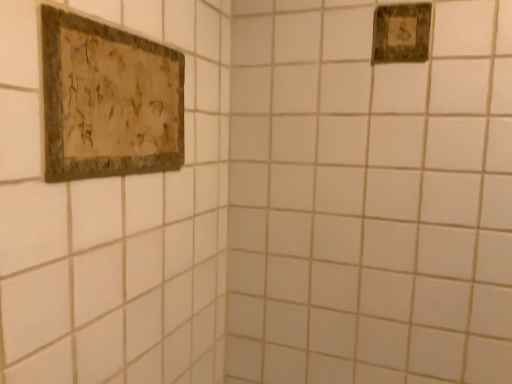
Question: In the image, is rustic wood sign at upper right, positioned as the 1th picture frame in top-to-bottom order, positioned in front of or behind rustic wood picture frame at upper left, acting as the second picture frame starting from the right?

Choices:
 (A) behind
 (B) front

Answer: (A)

Question: From the image's perspective, is rustic wood sign at upper right, placed as the 2th picture frame when sorted from left to right, positioned above or below rustic wood picture frame at upper left, the 2th picture frame in the back-to-front sequence?

Choices:
 (A) above
 (B) below

Answer: (A)

Question: In terms of width, does rustic wood sign at upper right, the 2th picture frame when ordered from bottom to top, look wider or thinner when compared to rustic wood picture frame at upper left, the 1th picture frame from the left?

Choices:
 (A) wide
 (B) thin

Answer: (B)

Question: Looking at their shapes, would you say rustic wood picture frame at upper left, the 1th picture frame from the left, is wider or thinner than rustic wood sign at upper right, which is the 2th picture frame from front to back?

Choices:
 (A) thin
 (B) wide

Answer: (B)

Question: Is point (160, 82) positioned closer to the camera than point (387, 36)?

Choices:
 (A) farther
 (B) closer

Answer: (B)

Question: Would you say rustic wood picture frame at upper left, which is the second picture frame from top to bottom, is inside or outside rustic wood sign at upper right, the 2th picture frame when ordered from bottom to top?

Choices:
 (A) inside
 (B) outside

Answer: (B)

Question: Would you say rustic wood picture frame at upper left, the 1th picture frame from the front, is to the left or to the right of rustic wood sign at upper right, placed as the 2th picture frame when sorted from left to right, in the picture?

Choices:
 (A) right
 (B) left

Answer: (B)